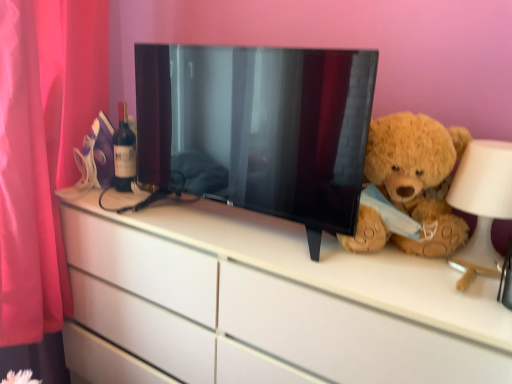
The height and width of the screenshot is (384, 512). Identify the location of free region under fuzzy brown teddy bear at right (from a real-world perspective). (398, 254).